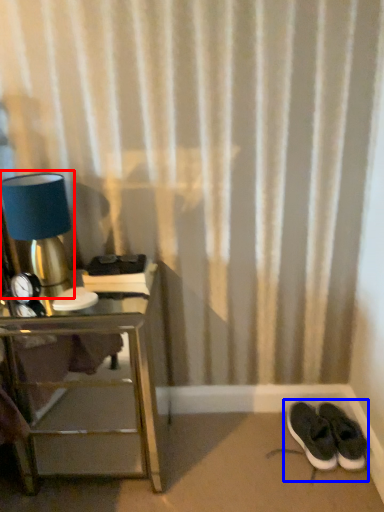
Question: Which point is further to the camera, table lamp (highlighted by a red box) or footwear (highlighted by a blue box)?

Choices:
 (A) table lamp
 (B) footwear

Answer: (B)